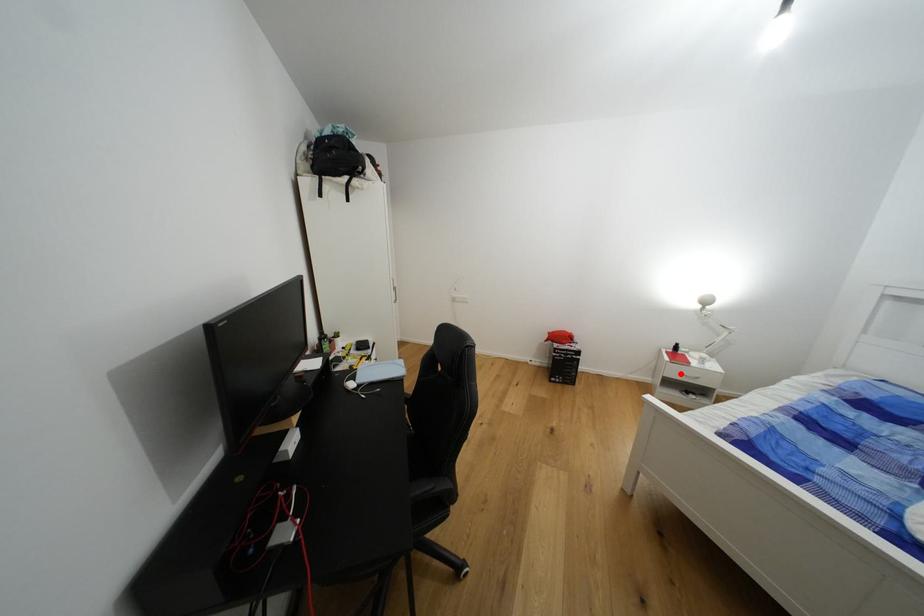
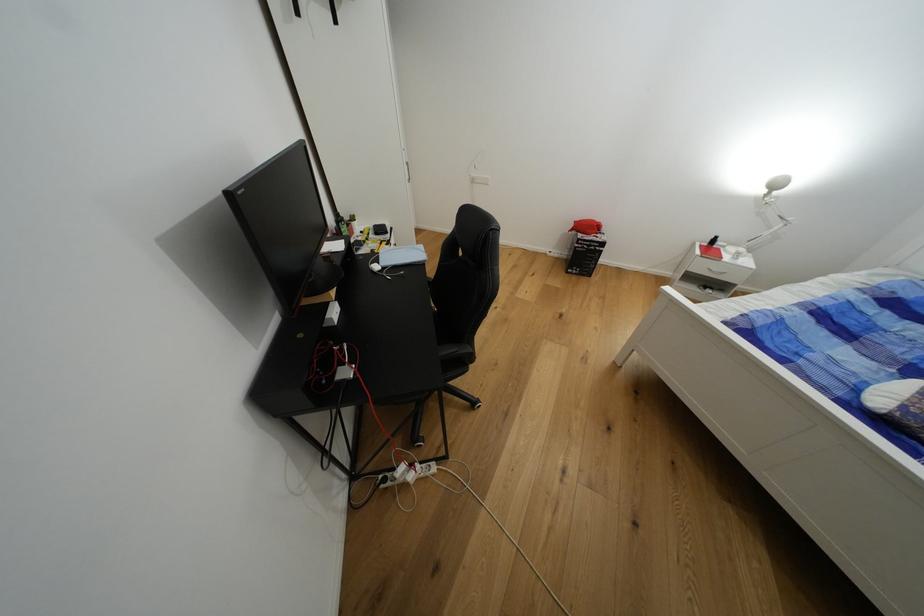
Question: I am providing you with two images of the same scene from different viewpoints. A red point is shown in image1. For the corresponding object point in image2, is it positioned nearer or farther from the camera?

Choices:
 (A) Nearer
 (B) Farther

Answer: (A)